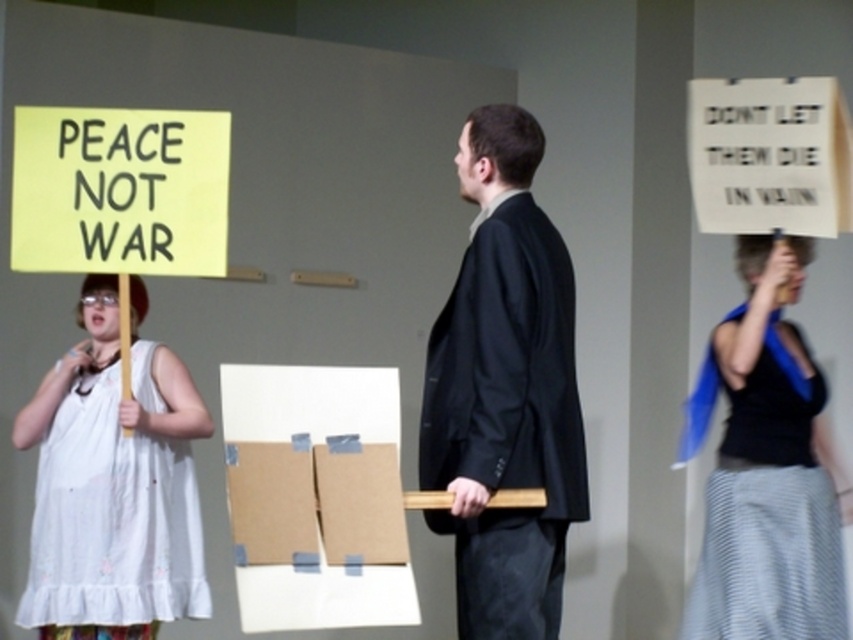
Describe the element at coordinates (767, 474) in the screenshot. I see `black matte tank top at right` at that location.

Between point (749, 307) and point (218, 275), which one is positioned in front?

Point (218, 275) is more forward.

The width and height of the screenshot is (853, 640). Describe the element at coordinates (767, 474) in the screenshot. I see `black matte tank top at right` at that location.

Locate an element on the screen. The image size is (853, 640). black matte tank top at right is located at coordinates (767, 474).

Between point (556, 600) and point (721, 572), which one is positioned behind?

The point (721, 572) is behind.

Is point (550, 259) farther from camera compared to point (787, 332)?

No, it is not.

Identify the location of black smooth suit at center. This screenshot has height=640, width=853. (503, 392).

Is point (828, 570) closer to viewer compared to point (47, 433)?

No, it is behind (47, 433).

Which is behind, point (793, 588) or point (148, 552)?

The point (793, 588) is behind.

Which is in front, point (785, 358) or point (48, 486)?

Point (48, 486)

You are a GUI agent. You are given a task and a screenshot of the screen. Output one action in this format:
    pyautogui.click(x=<x>, y=<y>)
    Task: Click on the black matte tank top at right
    This screenshot has width=853, height=640.
    Given the screenshot: What is the action you would take?
    pyautogui.click(x=767, y=474)